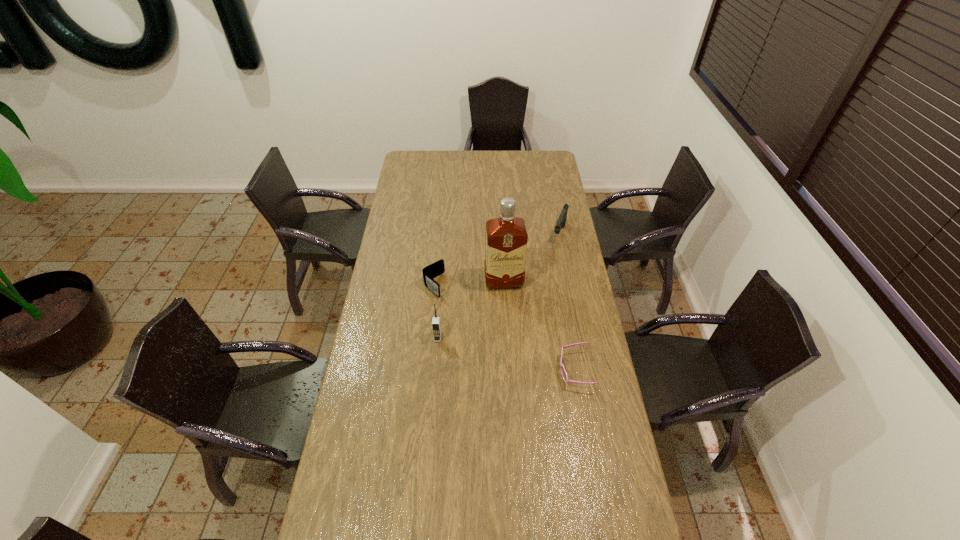
At what (x,y) coordinates should I click in order to perform the action: click on free space located on the front-facing side of the nearest object. Please return your answer as a coordinate pair (x, y). The height and width of the screenshot is (540, 960). Looking at the image, I should click on (516, 370).

This screenshot has width=960, height=540. Identify the location of free region located on the front-facing side of the nearest object. (462, 370).

Where is `free region located 0.300m on the front-facing side of the nearest object`? The width and height of the screenshot is (960, 540). free region located 0.300m on the front-facing side of the nearest object is located at coordinates (478, 370).

Where is `free space located 0.320m on the front label of the third object from right to left`? free space located 0.320m on the front label of the third object from right to left is located at coordinates (515, 353).

This screenshot has height=540, width=960. What are the coordinates of `vacant space located on the front label of the third object from right to left` in the screenshot? It's located at (510, 319).

This screenshot has height=540, width=960. Find the location of `free point located on the front label of the third object from right to left`. free point located on the front label of the third object from right to left is located at coordinates (516, 360).

Find the location of a particular element. The width and height of the screenshot is (960, 540). vacant space located 0.210m on the outer surface of the wallet is located at coordinates (471, 325).

Image resolution: width=960 pixels, height=540 pixels. What are the coordinates of `free space located on the outer surface of the wallet` in the screenshot? It's located at (503, 354).

Find the location of `vacant space situated 0.390m on the outer surface of the wallet`. vacant space situated 0.390m on the outer surface of the wallet is located at coordinates (501, 353).

Identify the location of free location located 0.160m at the barrel of the third tallest object. Image resolution: width=960 pixels, height=540 pixels. (549, 267).